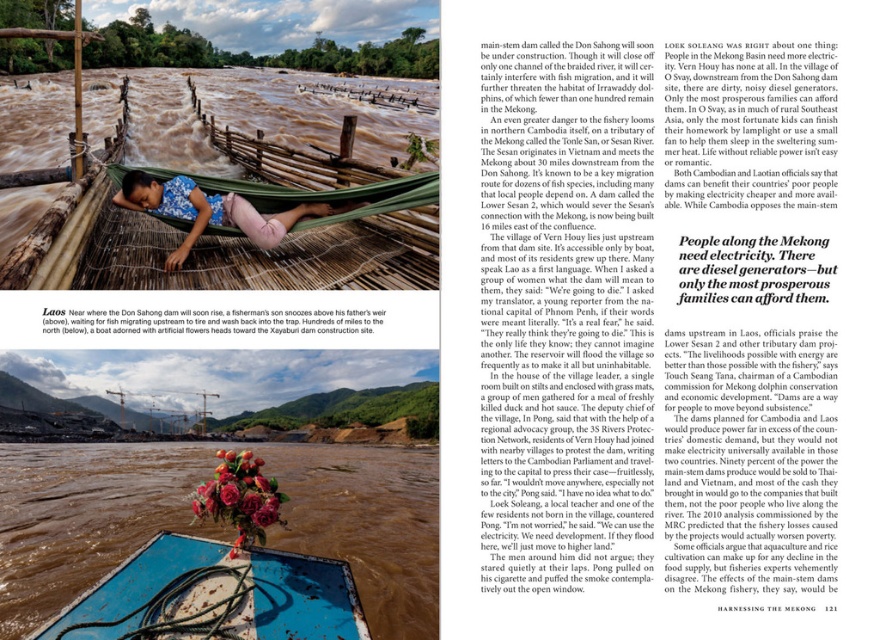
You are a tourist planning to cross the river in the top section of the image. You see a blue rubber boat at lower center and a floral fabric hammock at center. Which object is more suitable for crossing the river?

The blue rubber boat at lower center is more suitable for crossing the river because it is designed for water travel, whereas the floral fabric hammock at center is meant for resting and not built for navigating turbulent waters.

You are a photographer standing at the edge of the river in the top section of the image. You want to take a photo of the young girl in the hammock. Which point, point 1 at coordinates (358, 474) or point 2 at coordinates (89, 589), is closer to your camera lens?

Point 2 at coordinates (89, 589) is closer to the camera lens because it is less distant than point 1 at coordinates (358, 474).